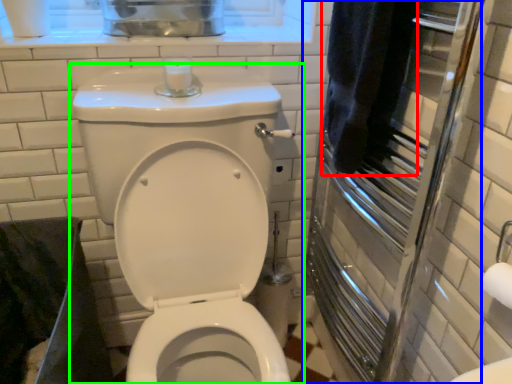
Question: Which object is positioned farthest from bath towel (highlighted by a red box)? Select from screen door (highlighted by a blue box) and toilet (highlighted by a green box).

Choices:
 (A) screen door
 (B) toilet

Answer: (B)